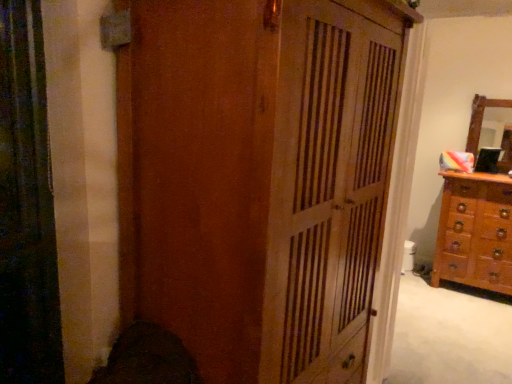
What do you see at coordinates (481, 118) in the screenshot? The width and height of the screenshot is (512, 384). I see `wooden mirror at right` at bounding box center [481, 118].

The width and height of the screenshot is (512, 384). I want to click on wooden cupboard at center, so click(259, 179).

Does wooden chest of drawers at right come behind wooden cupboard at center?

Yes, it is behind wooden cupboard at center.

Considering the relative sizes of wooden chest of drawers at right and wooden cupboard at center in the image provided, is wooden chest of drawers at right shorter than wooden cupboard at center?

Correct, wooden chest of drawers at right is not as tall as wooden cupboard at center.

Is wooden chest of drawers at right oriented away from wooden cupboard at center?

No, wooden chest of drawers at right is not facing away from wooden cupboard at center.

From a real-world perspective, is wooden mirror at right under wooden chest of drawers at right?

No, from a real-world perspective, wooden mirror at right is not below wooden chest of drawers at right.

Can you tell me how much wooden mirror at right and wooden chest of drawers at right differ in facing direction?

The facing directions of wooden mirror at right and wooden chest of drawers at right are 0.175 degrees apart.

Would you consider wooden mirror at right to be distant from wooden chest of drawers at right?

No, there isn't a large distance between wooden mirror at right and wooden chest of drawers at right.

Between wooden mirror at right and wooden chest of drawers at right, which one has larger size?

wooden chest of drawers at right is bigger.

Is wooden cupboard at center at the back of wooden mirror at right?

No, wooden mirror at right's orientation is not away from wooden cupboard at center.

Is the position of wooden mirror at right less distant than that of wooden cupboard at center?

That is False.

Image resolution: width=512 pixels, height=384 pixels. What are the coordinates of `cupboard on the left of wooden mirror at right` in the screenshot? It's located at (259, 179).

How distant is wooden mirror at right from wooden cupboard at center?

wooden mirror at right is 9.29 feet from wooden cupboard at center.

In the scene shown: Considering the relative sizes of wooden chest of drawers at right and wooden mirror at right in the image provided, is wooden chest of drawers at right bigger than wooden mirror at right?

Correct, wooden chest of drawers at right is larger in size than wooden mirror at right.

How different are the orientations of wooden chest of drawers at right and wooden mirror at right in degrees?

The angular difference between wooden chest of drawers at right and wooden mirror at right is 0.175 degrees.

Choose the correct answer: Is wooden chest of drawers at right inside wooden mirror at right or outside it?

wooden chest of drawers at right is not inside wooden mirror at right, it's outside.

Is wooden chest of drawers at right not close to wooden mirror at right?

They are positioned close to each other.

Considering the sizes of objects wooden cupboard at center and wooden mirror at right in the image provided, who is wider, wooden cupboard at center or wooden mirror at right?

Wider between the two is wooden cupboard at center.

From the image's perspective, which one is positioned lower, wooden cupboard at center or wooden mirror at right?

wooden cupboard at center is shown below in the image.

From a real-world perspective, which is physically above, wooden cupboard at center or wooden mirror at right?

wooden mirror at right, from a real-world perspective.

Between wooden cupboard at center and wooden mirror at right, which one appears on the right side from the viewer's perspective?

Positioned to the right is wooden mirror at right.

Which object is closer to the camera taking this photo, wooden cupboard at center or wooden chest of drawers at right?

wooden cupboard at center is closer to the camera.

From a real-world perspective, is wooden cupboard at center under wooden chest of drawers at right?

No, from a real-world perspective, wooden cupboard at center is not beneath wooden chest of drawers at right.

Considering the sizes of objects wooden cupboard at center and wooden chest of drawers at right in the image provided, who is wider, wooden cupboard at center or wooden chest of drawers at right?

With larger width is wooden cupboard at center.

How distant is wooden cupboard at center from wooden chest of drawers at right?

wooden cupboard at center and wooden chest of drawers at right are 2.44 meters apart.

Where is `cupboard above the wooden chest of drawers at right (from the image's perspective)`? The width and height of the screenshot is (512, 384). cupboard above the wooden chest of drawers at right (from the image's perspective) is located at coordinates (259, 179).

Where is `chest of drawers to the left of wooden mirror at right`? chest of drawers to the left of wooden mirror at right is located at coordinates (475, 232).

Looking at the image, which one is located further to wooden mirror at right, wooden cupboard at center or wooden chest of drawers at right?

wooden cupboard at center lies further to wooden mirror at right than the other object.

Considering their positions, is wooden mirror at right positioned closer to wooden cupboard at center than wooden chest of drawers at right?

The object closer to wooden cupboard at center is wooden chest of drawers at right.

Looking at the image, which one is located closer to wooden chest of drawers at right, wooden cupboard at center or wooden mirror at right?

wooden mirror at right is closer to wooden chest of drawers at right.

From the picture: Based on their spatial positions, is wooden chest of drawers at right or wooden mirror at right closer to wooden cupboard at center?

Based on the image, wooden chest of drawers at right appears to be nearer to wooden cupboard at center.

Considering their positions, is wooden mirror at right positioned further to wooden chest of drawers at right than wooden cupboard at center?

wooden cupboard at center.

From the picture: Considering their positions, is wooden chest of drawers at right positioned further to wooden mirror at right than wooden cupboard at center?

wooden cupboard at center lies further to wooden mirror at right than the other object.

Image resolution: width=512 pixels, height=384 pixels. What are the coordinates of `the chest of drawers positioned between wooden cupboard at center and wooden mirror at right from near to far` in the screenshot? It's located at (475, 232).